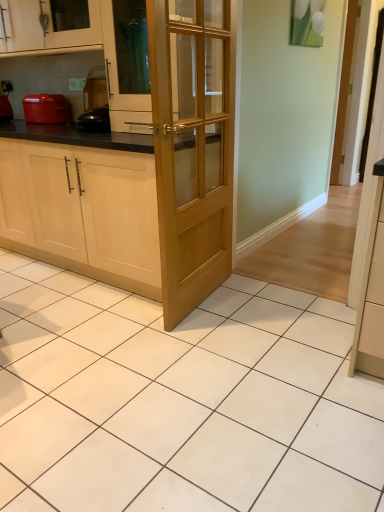
Measure the distance between point (159, 71) and camera.

Point (159, 71) is 1.70 meters away from camera.

Image resolution: width=384 pixels, height=512 pixels. What do you see at coordinates (46, 109) in the screenshot?
I see `matte red pot at left` at bounding box center [46, 109].

The width and height of the screenshot is (384, 512). I want to click on matte wood cabinet at upper left, which is counted as the 2th cabinetry, starting from the bottom, so click(x=47, y=28).

Can you confirm if light wood cabinet at center, which is the first cabinetry in bottom-to-top order, is positioned to the left of light brown wooden door at center?

Yes, light wood cabinet at center, which is the first cabinetry in bottom-to-top order, is to the left of light brown wooden door at center.

From a real-world perspective, relative to light brown wooden door at center, is light wood cabinet at center, acting as the 2th cabinetry starting from the top, vertically above or below?

In terms of real-world spatial position, light wood cabinet at center, acting as the 2th cabinetry starting from the top, is below light brown wooden door at center.

Between light wood cabinet at center, which is the first cabinetry in bottom-to-top order, and light brown wooden door at center, which one has less height?

light wood cabinet at center, which is the first cabinetry in bottom-to-top order, is shorter.

Between light wood cabinet at center, acting as the 2th cabinetry starting from the top, and light brown wooden door at center, which one has larger size?

light wood cabinet at center, acting as the 2th cabinetry starting from the top, is bigger.

Is matte red pot at left bigger or smaller than matte wood cabinet at upper left, the first cabinetry when ordered from top to bottom?

matte red pot at left is smaller than matte wood cabinet at upper left, the first cabinetry when ordered from top to bottom.

Which of these two, matte red pot at left or matte wood cabinet at upper left, which is counted as the 2th cabinetry, starting from the bottom, stands taller?

matte wood cabinet at upper left, which is counted as the 2th cabinetry, starting from the bottom.

Does matte red pot at left come behind matte wood cabinet at upper left, which is counted as the 2th cabinetry, starting from the bottom?

Yes, matte red pot at left is further from the viewer.

Which is more to the left, matte red pot at left or matte wood cabinet at upper left, which is counted as the 2th cabinetry, starting from the bottom?

matte red pot at left is more to the left.

Where is `appliance on the left side of matte wood cabinet at upper left, the first cabinetry when ordered from top to bottom`? The width and height of the screenshot is (384, 512). appliance on the left side of matte wood cabinet at upper left, the first cabinetry when ordered from top to bottom is located at coordinates (5, 109).

Which of these two, matte wood cabinet at upper left, which is counted as the 2th cabinetry, starting from the bottom, or matte red pot at left, is smaller?

matte red pot at left.

Is matte wood cabinet at upper left, which is counted as the 2th cabinetry, starting from the bottom, further to the viewer compared to matte red pot at left?

No, it is not.

Which is more to the right, matte wood cabinet at upper left, the first cabinetry when ordered from top to bottom, or matte red pot at left?

matte red pot at left is more to the right.

Is matte wood cabinet at upper left, which is counted as the 2th cabinetry, starting from the bottom, oriented towards matte red pot at left?

No.

Which object is further away from the camera taking this photo, light brown wooden door at center or matte red pot at left?

matte red pot at left.

Is light brown wooden door at center looking in the opposite direction of matte red pot at left?

Yes.

Is light brown wooden door at center to the left of matte red pot at left from the viewer's perspective?

In fact, light brown wooden door at center is to the right of matte red pot at left.

From the image's perspective, relative to matte wood cabinet at upper left, the first cabinetry when ordered from top to bottom, is light wood cabinet at center, acting as the 2th cabinetry starting from the top, above or below?

Clearly, from the image's perspective, light wood cabinet at center, acting as the 2th cabinetry starting from the top, is below matte wood cabinet at upper left, the first cabinetry when ordered from top to bottom.

Is light wood cabinet at center, acting as the 2th cabinetry starting from the top, facing towards matte wood cabinet at upper left, which is counted as the 2th cabinetry, starting from the bottom?

No, light wood cabinet at center, acting as the 2th cabinetry starting from the top, is not turned towards matte wood cabinet at upper left, which is counted as the 2th cabinetry, starting from the bottom.

From the picture: What's the angular difference between light wood cabinet at center, which is the first cabinetry in bottom-to-top order, and matte wood cabinet at upper left, which is counted as the 2th cabinetry, starting from the bottom,'s facing directions?

light wood cabinet at center, which is the first cabinetry in bottom-to-top order, and matte wood cabinet at upper left, which is counted as the 2th cabinetry, starting from the bottom, are facing 0.347 degrees away from each other.

Can we say light wood cabinet at center, acting as the 2th cabinetry starting from the top, lies outside matte wood cabinet at upper left, which is counted as the 2th cabinetry, starting from the bottom?

Yes.

Where is `door in front of the matte wood cabinet at upper left, which is counted as the 2th cabinetry, starting from the bottom`? The height and width of the screenshot is (512, 384). door in front of the matte wood cabinet at upper left, which is counted as the 2th cabinetry, starting from the bottom is located at coordinates (191, 148).

What's the angular difference between matte wood cabinet at upper left, the first cabinetry when ordered from top to bottom, and light brown wooden door at center's facing directions?

95.6 degrees separate the facing orientations of matte wood cabinet at upper left, the first cabinetry when ordered from top to bottom, and light brown wooden door at center.

Considering the sizes of objects matte wood cabinet at upper left, the first cabinetry when ordered from top to bottom, and light brown wooden door at center in the image provided, who is thinner, matte wood cabinet at upper left, the first cabinetry when ordered from top to bottom, or light brown wooden door at center?

Thinner between the two is light brown wooden door at center.

Is matte wood cabinet at upper left, which is counted as the 2th cabinetry, starting from the bottom, far away from light brown wooden door at center?

Yes.

I want to click on door positioned vertically above the light wood cabinet at center, which is the first cabinetry in bottom-to-top order (from a real-world perspective), so pos(191,148).

Where is `kitchen appliance below the matte wood cabinet at upper left, the first cabinetry when ordered from top to bottom (from a real-world perspective)`? This screenshot has width=384, height=512. kitchen appliance below the matte wood cabinet at upper left, the first cabinetry when ordered from top to bottom (from a real-world perspective) is located at coordinates (46, 109).

Estimate the real-world distances between objects in this image. Which object is closer to matte wood cabinet at upper left, the first cabinetry when ordered from top to bottom, light wood cabinet at center, which is the first cabinetry in bottom-to-top order, or matte red pot at left?

The object closer to matte wood cabinet at upper left, the first cabinetry when ordered from top to bottom, is matte red pot at left.

From the image, which object appears to be nearer to matte red pot at left, light wood cabinet at center, acting as the 2th cabinetry starting from the top, or matte wood cabinet at upper left, the first cabinetry when ordered from top to bottom?

matte wood cabinet at upper left, the first cabinetry when ordered from top to bottom, is positioned closer to the anchor matte red pot at left.

Which object lies further to the anchor point matte red pot at left, matte red pot at left or matte wood cabinet at upper left, which is counted as the 2th cabinetry, starting from the bottom?

matte wood cabinet at upper left, which is counted as the 2th cabinetry, starting from the bottom, is further to matte red pot at left.

When comparing their distances from light brown wooden door at center, does matte red pot at left or light wood cabinet at center, which is the first cabinetry in bottom-to-top order, seem further?

Among the two, matte red pot at left is located further to light brown wooden door at center.

Based on their spatial positions, is light brown wooden door at center or matte red pot at left closer to light wood cabinet at center, acting as the 2th cabinetry starting from the top?

light brown wooden door at center is closer to light wood cabinet at center, acting as the 2th cabinetry starting from the top.

In the scene shown: Estimate the real-world distances between objects in this image. Which object is further from matte wood cabinet at upper left, which is counted as the 2th cabinetry, starting from the bottom, matte red pot at left or light brown wooden door at center?

light brown wooden door at center.

When comparing their distances from light brown wooden door at center, does matte red pot at left or matte wood cabinet at upper left, the first cabinetry when ordered from top to bottom, seem further?

matte red pot at left is positioned further to the anchor light brown wooden door at center.

When comparing their distances from matte red pot at left, does matte red pot at left or light wood cabinet at center, which is the first cabinetry in bottom-to-top order, seem further?

The object further to matte red pot at left is light wood cabinet at center, which is the first cabinetry in bottom-to-top order.

The height and width of the screenshot is (512, 384). What are the coordinates of `kitchen appliance positioned between light brown wooden door at center and matte red pot at left from near to far` in the screenshot? It's located at (46, 109).

Image resolution: width=384 pixels, height=512 pixels. I want to click on cabinetry between matte wood cabinet at upper left, the first cabinetry when ordered from top to bottom, and light brown wooden door at center, so [82, 211].

Where is `kitchen appliance located between light wood cabinet at center, which is the first cabinetry in bottom-to-top order, and matte red pot at left in the depth direction`? kitchen appliance located between light wood cabinet at center, which is the first cabinetry in bottom-to-top order, and matte red pot at left in the depth direction is located at coordinates (46, 109).

Where is `cabinetry between light wood cabinet at center, acting as the 2th cabinetry starting from the top, and matte red pot at left, along the z-axis`? This screenshot has height=512, width=384. cabinetry between light wood cabinet at center, acting as the 2th cabinetry starting from the top, and matte red pot at left, along the z-axis is located at coordinates (47, 28).